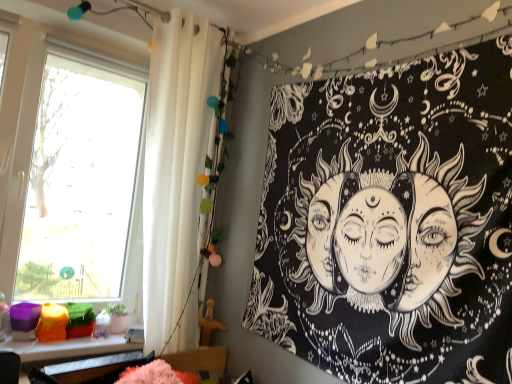
Where is `free spot above black paper tapestry at upper right (from a real-world perspective)`? free spot above black paper tapestry at upper right (from a real-world perspective) is located at coordinates (372, 57).